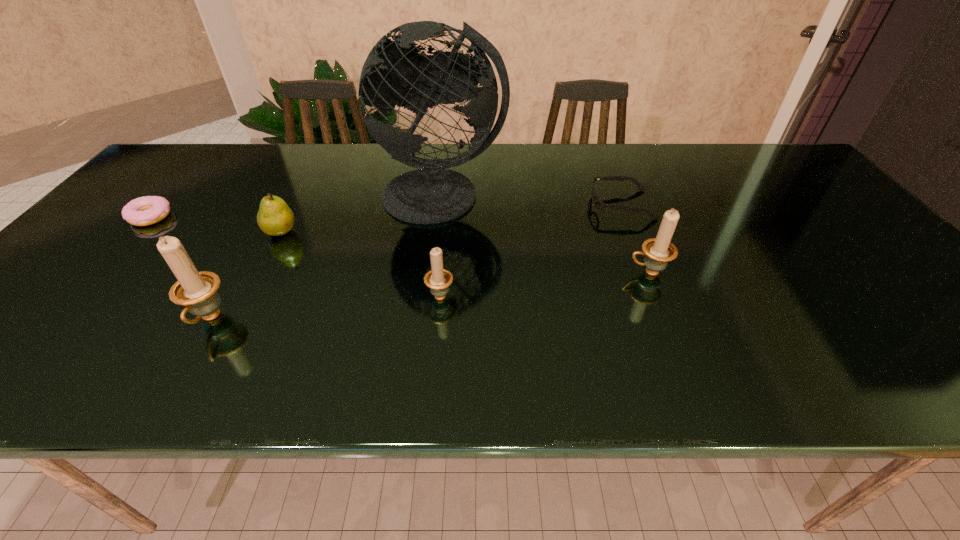
The image size is (960, 540). In order to click on free space at the far right corner in this screenshot , I will do `click(804, 177)`.

Locate an element on the screen. This screenshot has width=960, height=540. empty space between the spectacles and the second tallest object is located at coordinates (416, 262).

At what (x,y) coordinates should I click in order to perform the action: click on vacant region between the fifth shortest object and the tallest candle_holder. Please return your answer as a coordinate pair (x, y). The width and height of the screenshot is (960, 540). Looking at the image, I should click on (429, 295).

Image resolution: width=960 pixels, height=540 pixels. I want to click on unoccupied area between the globe and the tallest candle_holder, so click(x=325, y=258).

At what (x,y) coordinates should I click in order to perform the action: click on vacant space that is in between the leftmost candle_holder and the shortest candle_holder. Please return your answer as a coordinate pair (x, y). Looking at the image, I should click on (324, 307).

Image resolution: width=960 pixels, height=540 pixels. Identify the location of vacant space in between the sixth shortest object and the pear. (245, 275).

The width and height of the screenshot is (960, 540). I want to click on empty space between the second tallest candle_holder and the pear, so click(465, 252).

Find the location of a particular element. The image size is (960, 540). free space between the pear and the doughnut is located at coordinates (216, 224).

Identify the location of vacant space that's between the spectacles and the second shortest candle_holder. (635, 239).

In order to click on vacant area between the leftmost candle_holder and the spectacles in this screenshot , I will do `click(416, 262)`.